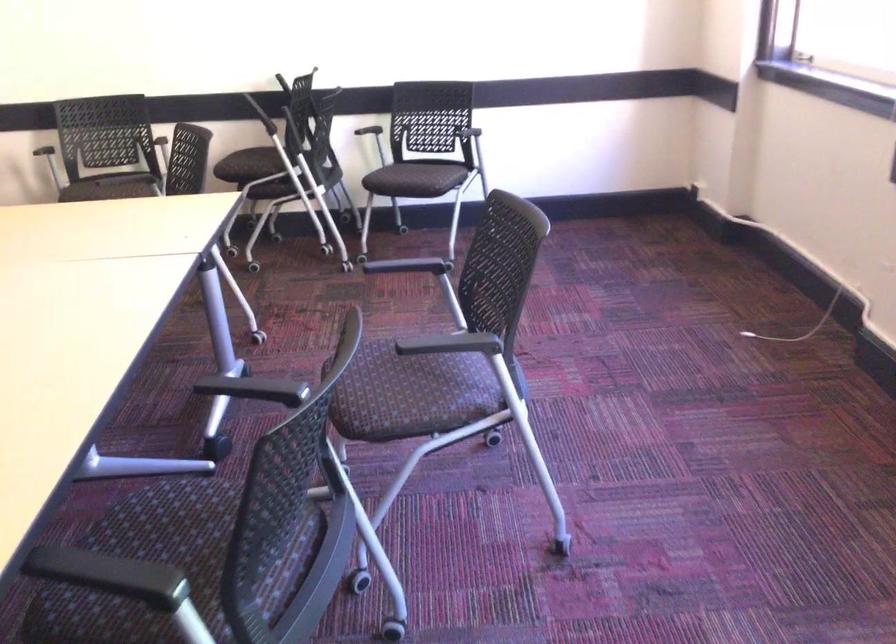
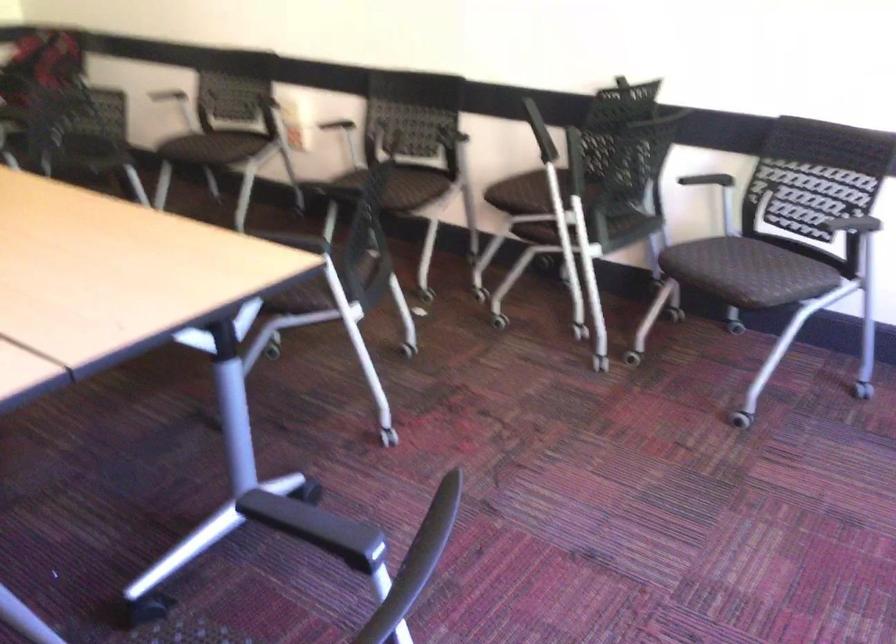
The point at (362, 120) is marked in the first image. Where is the corresponding point in the second image?

(718, 169)